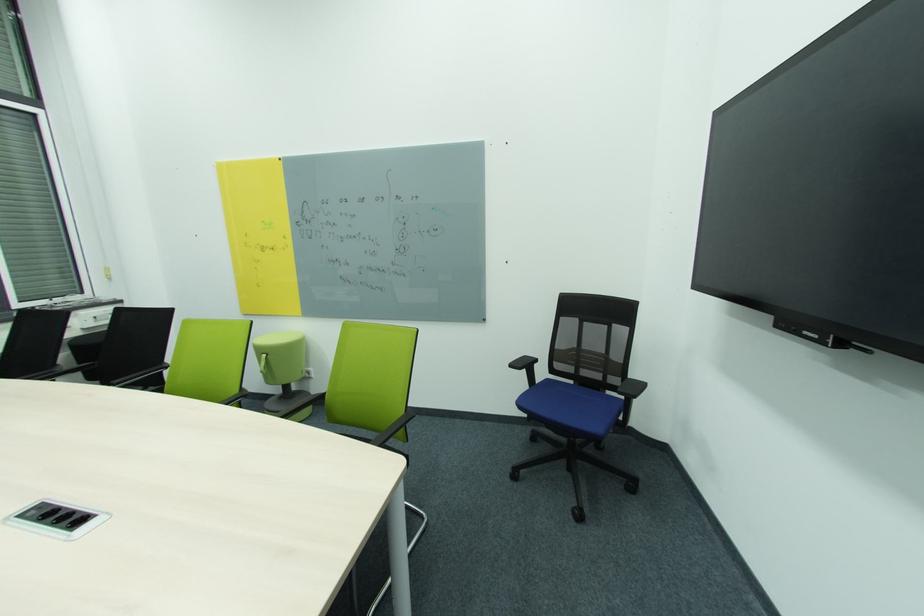
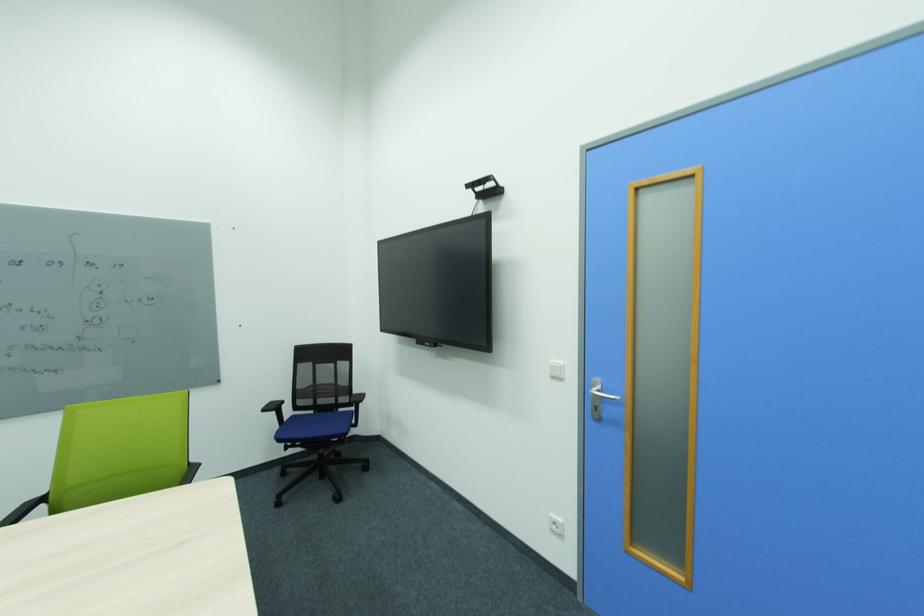
In the second image, find the point that corresponds to [552,382] in the first image.

(297, 418)